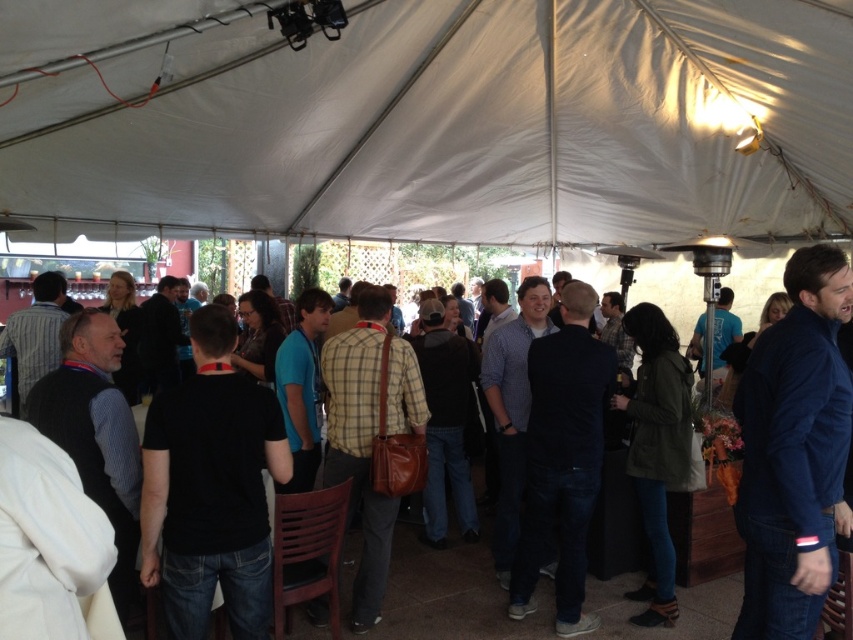
You are a photographer standing at the entrance of the tent. You want to take a photo of the white fabric canopy at upper center and the black shirt at center so that both are clearly visible. Considering their heights, which object should you position closer to the camera to ensure both are in focus?

The white fabric canopy at upper center has a lesser height compared to the black shirt at center. To ensure both are in focus, position the black shirt at center closer to the camera since it is taller and requires more space in the frame.

You are standing inside the tent and want to locate the white fabric canopy at upper center. What are the coordinates where you can find it?

The white fabric canopy at upper center is located at coordinates point [430,120].

You are standing inside the tent and want to touch the white fabric canopy at upper center and the black shirt at center. Which object will you reach first?

You will reach the black shirt at center first because it is closer to you than the white fabric canopy at upper center, which is further away.